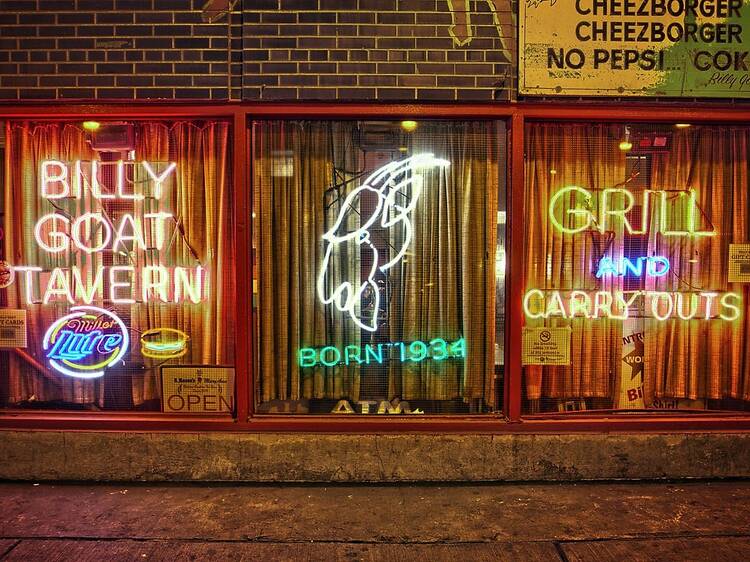
I want to click on brick wall, so click(321, 75).